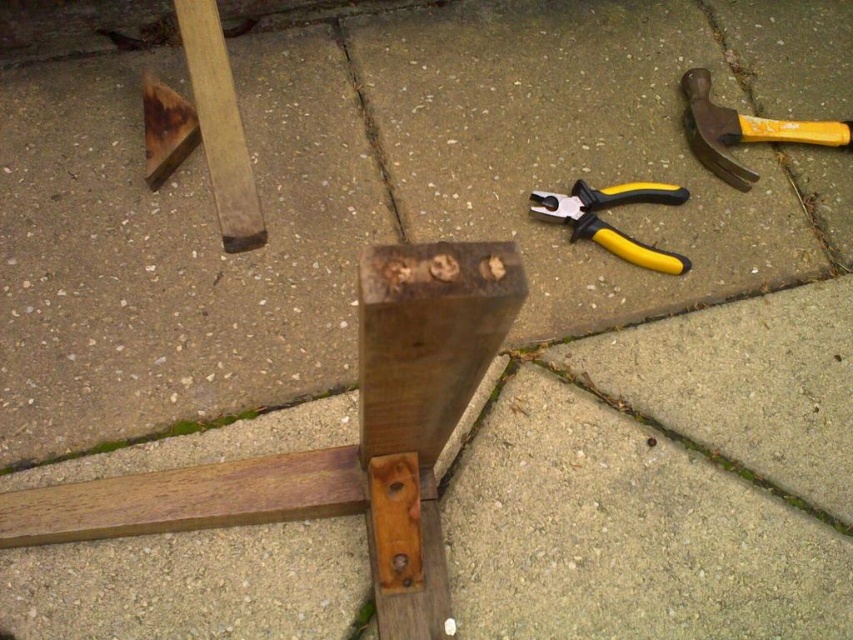
Which is below, brown wood plank at upper left or yellow rubber hammer at upper right?

brown wood plank at upper left is below.

Does brown wood plank at upper left have a lesser height compared to yellow rubber hammer at upper right?

No, brown wood plank at upper left is not shorter than yellow rubber hammer at upper right.

Does point (193, 67) come closer to viewer compared to point (733, 145)?

Yes, point (193, 67) is in front of point (733, 145).

I want to click on brown wood plank at upper left, so click(x=219, y=125).

Which of these two, natural wood post at center or yellow plastic pliers at center, stands shorter?

With less height is yellow plastic pliers at center.

In the scene shown: Can you confirm if natural wood post at center is wider than yellow plastic pliers at center?

Correct, the width of natural wood post at center exceeds that of yellow plastic pliers at center.

Does point (376, 298) come farther from viewer compared to point (531, 200)?

No, (376, 298) is in front of (531, 200).

Where is `natural wood post at center`? This screenshot has height=640, width=853. natural wood post at center is located at coordinates pyautogui.click(x=341, y=445).

In the scene shown: Is natural wood post at center to the right of yellow rubber hammer at upper right from the viewer's perspective?

In fact, natural wood post at center is to the left of yellow rubber hammer at upper right.

Who is taller, natural wood post at center or yellow rubber hammer at upper right?

natural wood post at center is taller.

The image size is (853, 640). What are the coordinates of `natural wood post at center` in the screenshot? It's located at (341, 445).